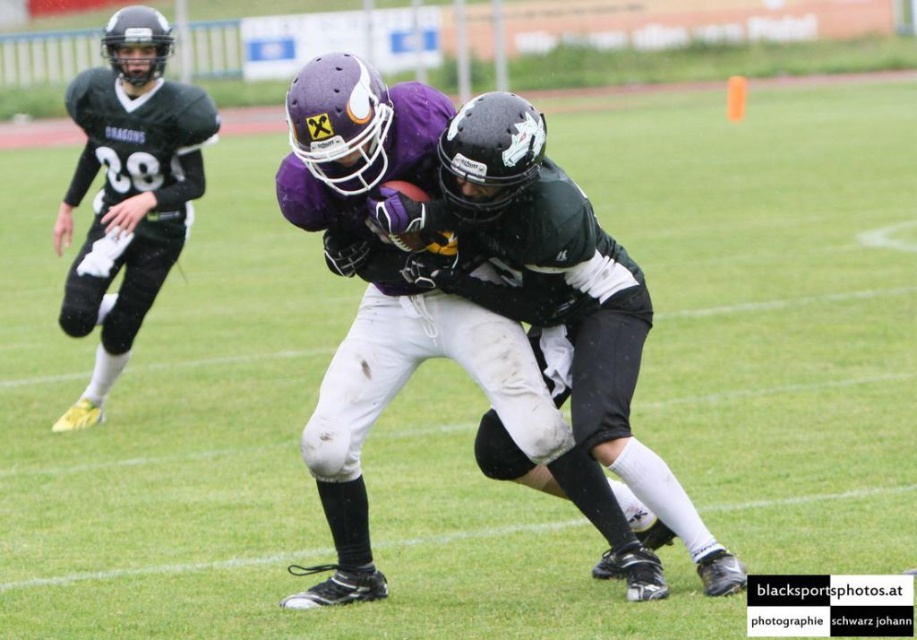
You are a referee observing the game. You notice the purple matte football helmet at center and the matte black jersey at left. Which object is located lower in the image?

The purple matte football helmet at center is positioned under the matte black jersey at left, so it is located lower in the image.

You are a sports analyst watching this American football game. You need to describe the position of the purple matte football helmet at center relative to the field. Where exactly is it located?

The purple matte football helmet at center is located at the coordinates point (407, 320) on the field.

You are a sports analyst watching the game. You notice the purple matte football helmet at center and the matte black jersey at left. Which object appears lower in the image?

The purple matte football helmet at center appears lower in the image because it has a lesser height compared to the matte black jersey at left.